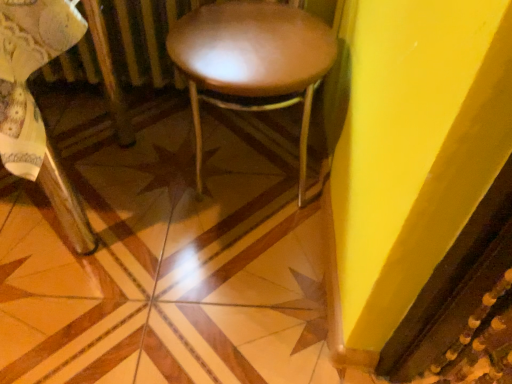
I want to click on vacant area that lies between wooden chair at center and leather-like brown stool at center, so click(204, 245).